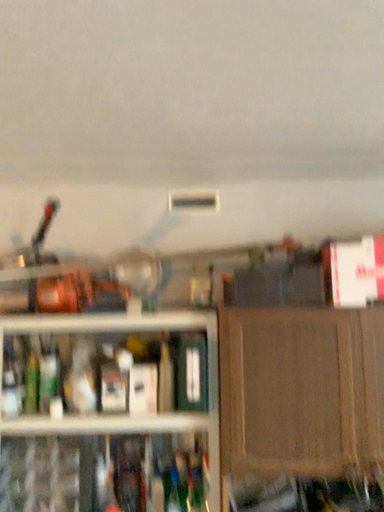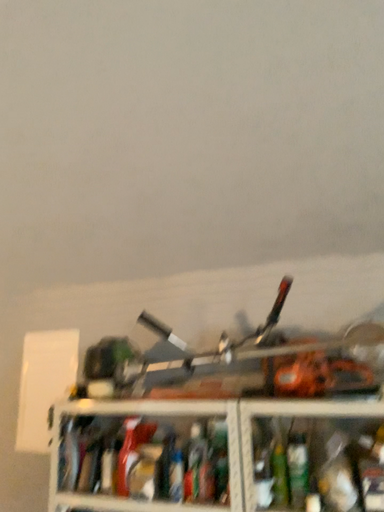
Question: Which way did the camera rotate in the video?

Choices:
 (A) rotated downward
 (B) rotated upward

Answer: (B)